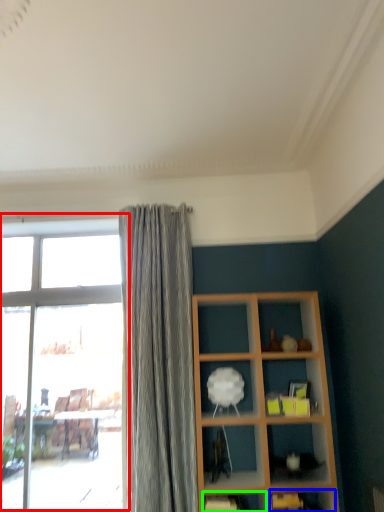
Question: Which is nearer to the window (highlighted by a red box)? shelf (highlighted by a blue box) or shelf (highlighted by a green box).

Choices:
 (A) shelf
 (B) shelf

Answer: (B)